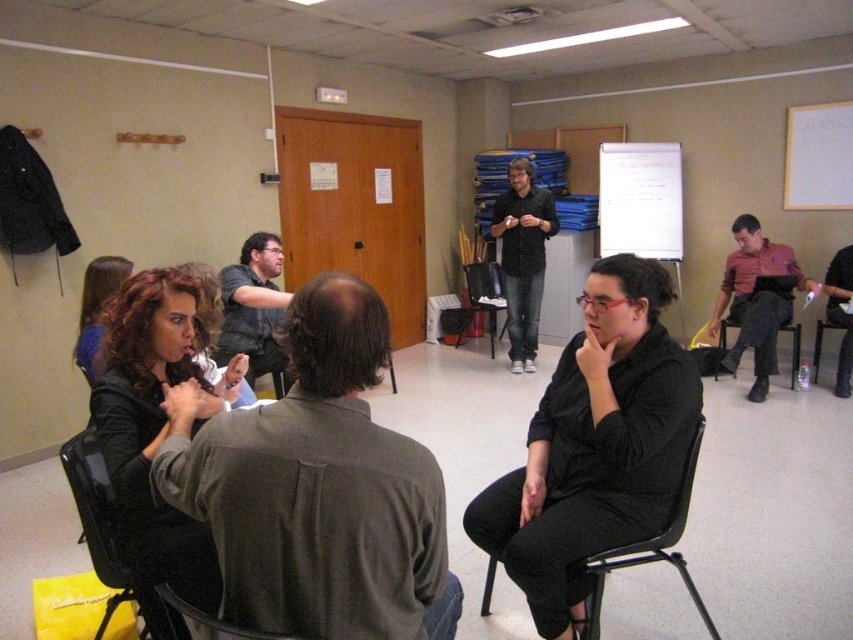
Question: Which of these objects is positioned farthest from the black plastic chair at center?

Choices:
 (A) white paper at upper center
 (B) matte black hair at lower left
 (C) black fabric chair at lower left

Answer: (C)

Question: Based on their relative distances, which object is farther from the matte black shirt at center?

Choices:
 (A) black plastic chair at center
 (B) black plastic chair at lower center

Answer: (B)

Question: Does matte black jacket at center have a lesser width compared to matte black shirt at center?

Choices:
 (A) yes
 (B) no

Answer: (A)

Question: Is matte pink shirt at right below matte black shirt at center?

Choices:
 (A) yes
 (B) no

Answer: (A)

Question: Is black leather pants at lower right further to camera compared to black plastic chair at lower center?

Choices:
 (A) no
 (B) yes

Answer: (B)

Question: Considering the real-world distances, which object is closest to the black plastic chair at lower center?

Choices:
 (A) matte black shirt at center
 (B) white paper at upper center
 (C) black fabric chair at lower left

Answer: (C)